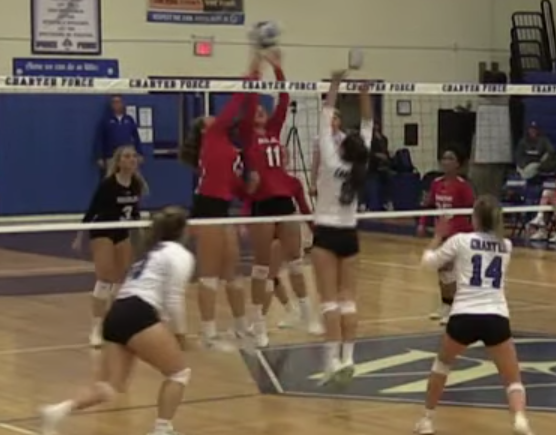
I want to click on glossy wooden gym floor, so click(59, 369).